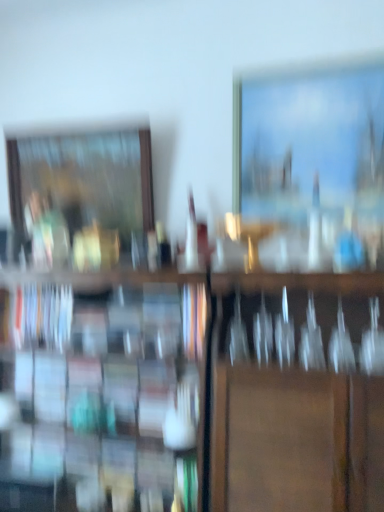
Question: Does point (49, 246) appear closer or farther from the camera than point (369, 97)?

Choices:
 (A) farther
 (B) closer

Answer: (A)

Question: In the image, is wooden picture frame at left, the 2th picture frame from the right, on the left side or the right side of matte wooden picture frame at upper right, acting as the 1th picture frame starting from the front?

Choices:
 (A) left
 (B) right

Answer: (A)

Question: Estimate the real-world distances between objects in this image. Which object is closer to the wooden picture frame at left, arranged as the first picture frame when viewed from the back?

Choices:
 (A) wooden bookshelf at center
 (B) hardcover book at left
 (C) matte wooden picture frame at upper right, acting as the 1th picture frame starting from the front

Answer: (B)

Question: Based on their relative distances, which object is nearer to the wooden bookshelf at center?

Choices:
 (A) wooden picture frame at left, the 2th picture frame from the right
 (B) matte wooden picture frame at upper right, which is the 2th picture frame in back-to-front order
 (C) hardcover book at left

Answer: (C)